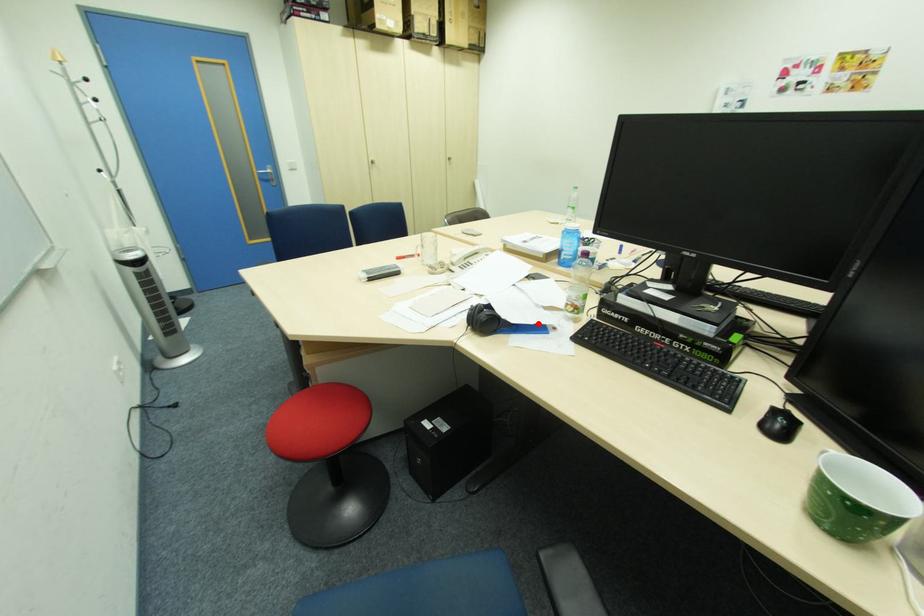
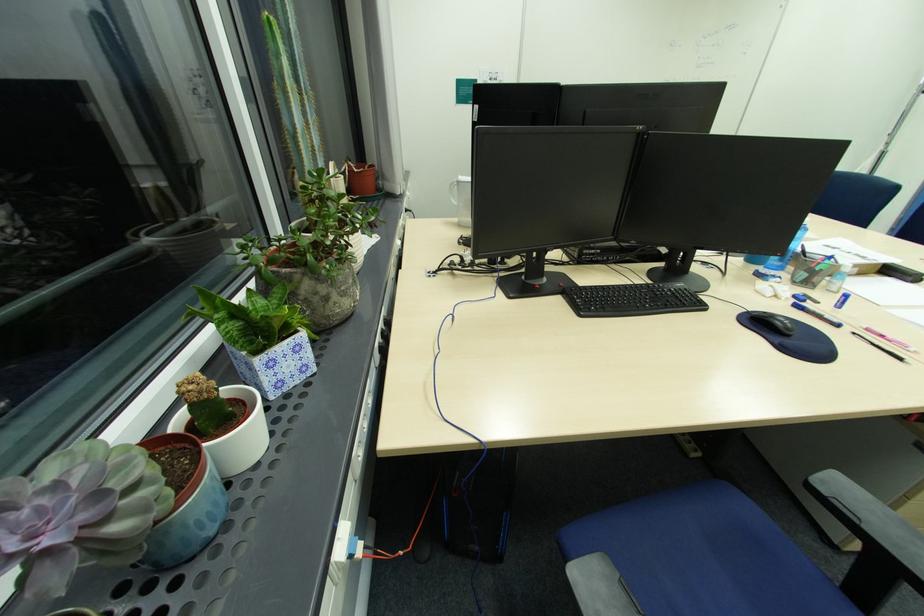
Question: I am providing you with two images of the same scene from different viewpoints. A red point is marked on the first image. Can you still see the location of the red point in image 2?

Choices:
 (A) Yes
 (B) No

Answer: (B)